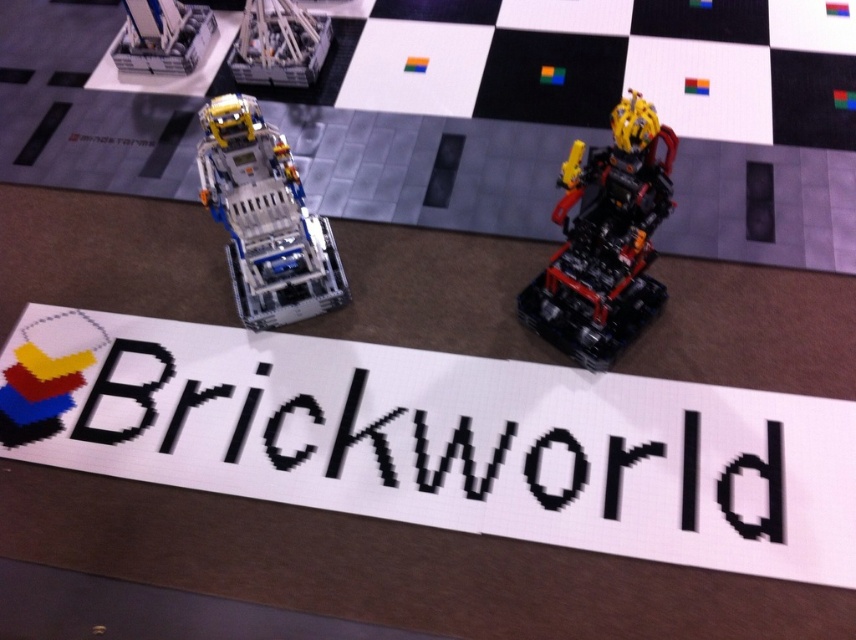
Does metallic blue robot at center-left have a larger size compared to translucent white plastic robot at upper left?

Yes.

Who is more distant from viewer, (211, 109) or (182, 48)?

The point (182, 48) is more distant.

Does point (247, 262) come closer to viewer compared to point (177, 28)?

Yes, point (247, 262) is closer to viewer.

You are a GUI agent. You are given a task and a screenshot of the screen. Output one action in this format:
    pyautogui.click(x=<x>, y=<y>)
    Task: Click on the metallic blue robot at center-left
    
    Given the screenshot: What is the action you would take?
    pyautogui.click(x=265, y=218)

Can you confirm if black pixelated text at center is positioned above translucent plastic structure at upper center?

Actually, black pixelated text at center is below translucent plastic structure at upper center.

Is point (402, 362) closer to viewer compared to point (239, 48)?

Yes.

You are a GUI agent. You are given a task and a screenshot of the screen. Output one action in this format:
    pyautogui.click(x=<x>, y=<y>)
    Task: Click on the black pixelated text at center
    
    Given the screenshot: What is the action you would take?
    pyautogui.click(x=438, y=440)

Is translucent plastic structure at upper center shorter than translucent white plastic robot at upper left?

Incorrect, translucent plastic structure at upper center's height does not fall short of translucent white plastic robot at upper left's.

Measure the distance between point (265, 10) and camera.

Point (265, 10) and camera are 3.63 meters apart.

Identify the location of translucent plastic structure at upper center. The width and height of the screenshot is (856, 640). (278, 44).